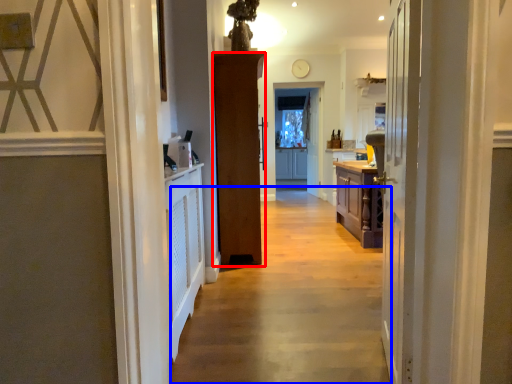
Question: Which object is closer to the camera taking this photo, door (highlighted by a red box) or path (highlighted by a blue box)?

Choices:
 (A) door
 (B) path

Answer: (B)